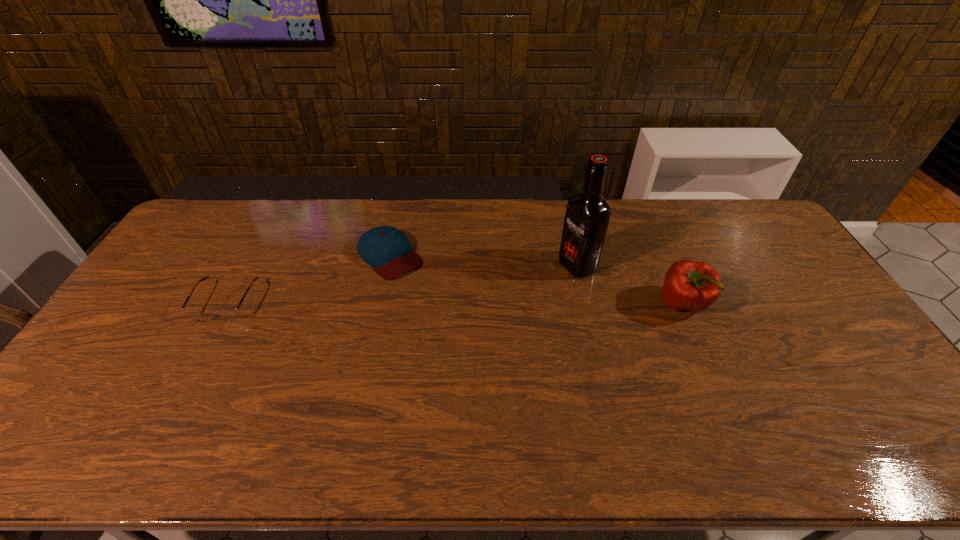
Where is `vacant position located 0.220m on the front-facing side of the liquor`? The width and height of the screenshot is (960, 540). vacant position located 0.220m on the front-facing side of the liquor is located at coordinates (507, 300).

The image size is (960, 540). Find the location of `free space located on the front-facing side of the liquor`. free space located on the front-facing side of the liquor is located at coordinates (496, 306).

This screenshot has height=540, width=960. I want to click on vacant space located on the front-facing side of the liquor, so click(x=548, y=280).

You are a GUI agent. You are given a task and a screenshot of the screen. Output one action in this format:
    pyautogui.click(x=<x>, y=<y>)
    Task: Click on the vacant region located 0.320m with the bill of the baseball cap facing forward
    The width and height of the screenshot is (960, 540).
    Given the screenshot: What is the action you would take?
    pyautogui.click(x=468, y=338)

The width and height of the screenshot is (960, 540). Find the location of `vacant space situated 0.080m with the bill of the baseball cap facing forward`. vacant space situated 0.080m with the bill of the baseball cap facing forward is located at coordinates (420, 289).

I want to click on vacant space located 0.280m with the bill of the baseball cap facing forward, so click(x=459, y=329).

Identify the location of object that is at the far edge. The height and width of the screenshot is (540, 960). (387, 250).

Locate an element on the screen. This screenshot has width=960, height=540. free space at the far edge of the desktop is located at coordinates pyautogui.click(x=697, y=214).

In the image, there is a desktop. Find the location of `vacant space at the near edge`. vacant space at the near edge is located at coordinates (293, 389).

At what (x,y) coordinates should I click in order to perform the action: click on vacant space at the left edge. Please return your answer as a coordinate pair (x, y). Looking at the image, I should click on (102, 341).